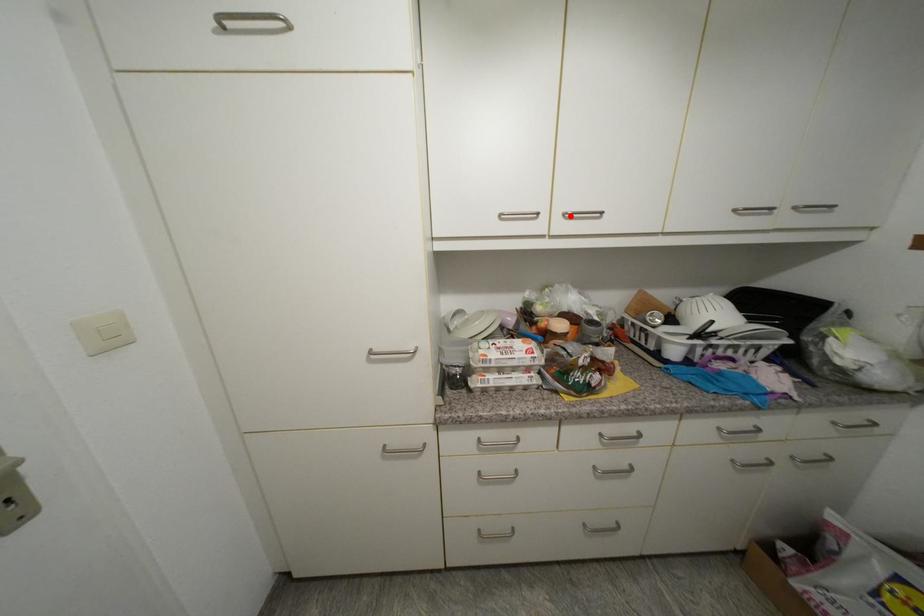
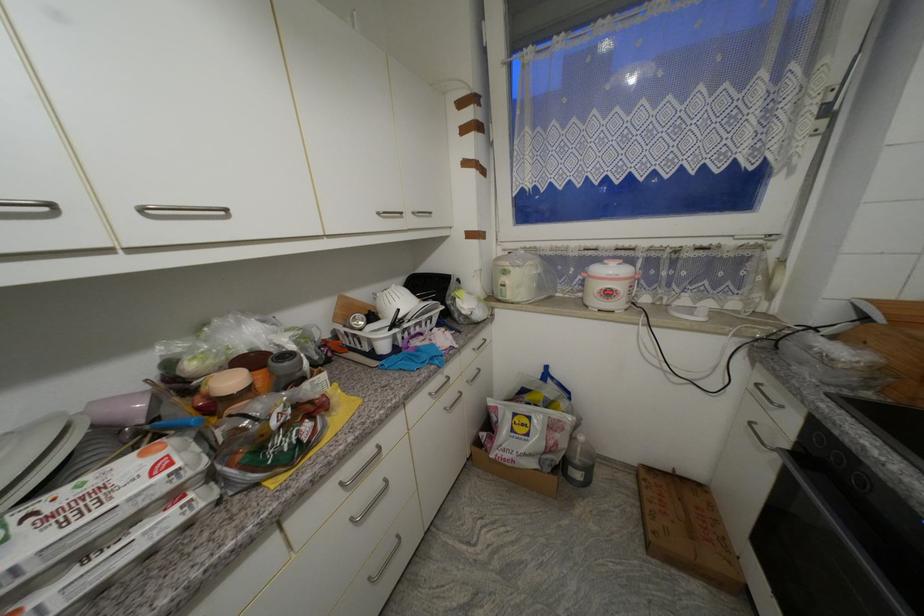
Where in the second image is the point corresponding to the highlighted location from the first image?

(149, 211)